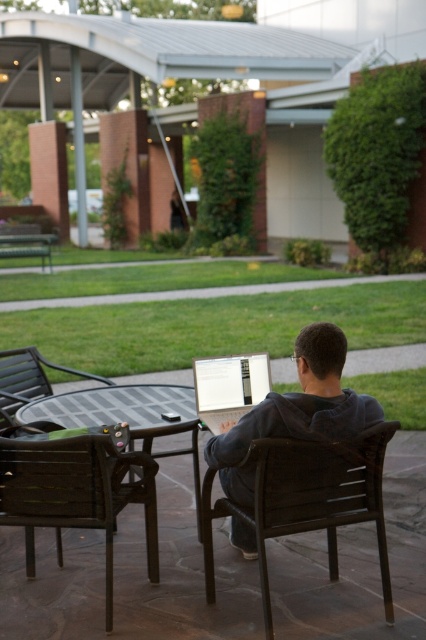
Question: Estimate the real-world distances between objects in this image. Which object is farther from the dark brown plastic chair at center?

Choices:
 (A) brown wooden chair at lower left
 (B) brown woven chair at center
 (C) dark gray hoodie at center
 (D) silver metallic laptop at center

Answer: (C)

Question: Observing the image, what is the correct spatial positioning of brown wooden chair at lower left in reference to dark brown plastic chair at center?

Choices:
 (A) below
 (B) above

Answer: (A)

Question: Does brown woven chair at center appear on the left side of dark brown plastic chair at center?

Choices:
 (A) yes
 (B) no

Answer: (B)

Question: Which point is closer to the camera?

Choices:
 (A) (203, 392)
 (B) (333, 522)
 (C) (32, 520)
 (D) (367, 424)

Answer: (D)

Question: Which object appears closest to the camera in this image?

Choices:
 (A) dark brown plastic chair at center
 (B) silver metallic laptop at center
 (C) brown woven chair at center
 (D) dark gray hoodie at center

Answer: (C)

Question: Does brown woven chair at center have a larger size compared to brown wooden chair at lower left?

Choices:
 (A) yes
 (B) no

Answer: (B)